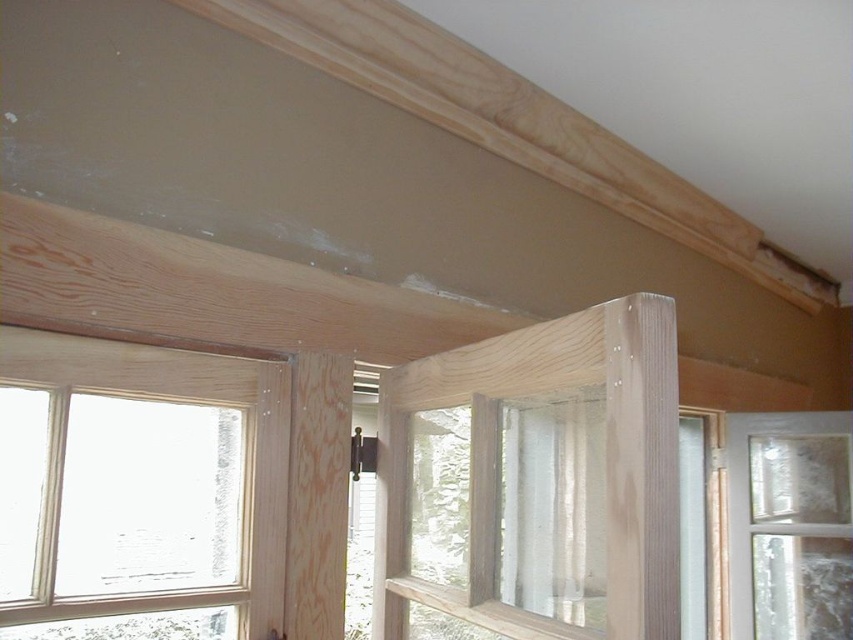
You are an inspector checking the construction site. You notice the natural wood window frame at left and the clear glass window at center. Which one is nearer to you?

The natural wood window frame at left is closer to the viewer than the clear glass window at center, so the natural wood window frame at left is nearer to you.

What is the 2D coordinate of the natural wood window frame at left in the image?

The natural wood window frame at left is located at the 2D coordinate point of [138,490].